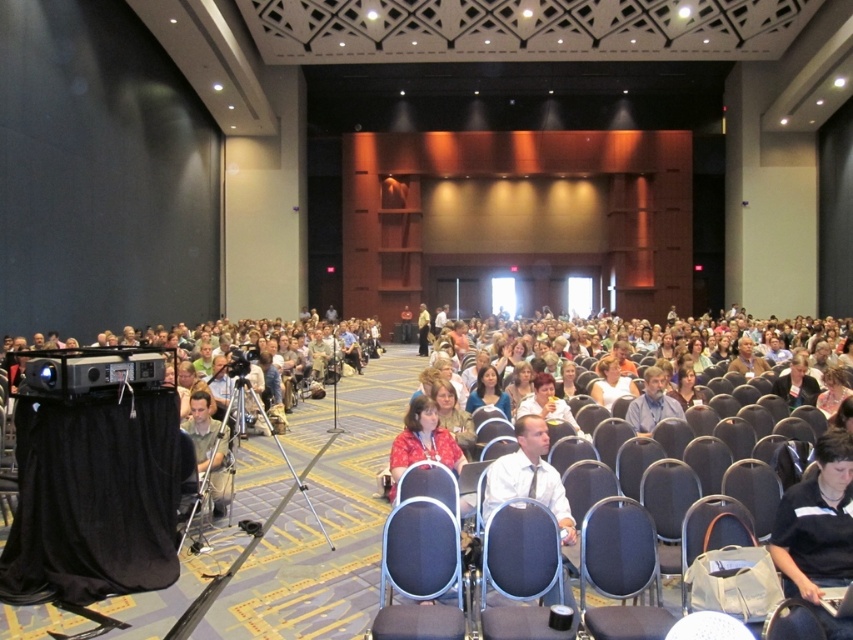
Who is shorter, black fabric chair at center or blue shirt at center?

blue shirt at center

Does black fabric chair at center lie behind blue shirt at center?

No.

Where is `black fabric chair at center`? The width and height of the screenshot is (853, 640). black fabric chair at center is located at coordinates (421, 573).

Describe the element at coordinates (712, 531) in the screenshot. I see `gray fabric chair at lower right` at that location.

Which is more to the right, gray fabric chair at lower right or matte black chair at lower right?

From the viewer's perspective, matte black chair at lower right appears more on the right side.

Which is in front, point (735, 504) or point (759, 493)?

Point (735, 504) is in front.

This screenshot has height=640, width=853. Find the location of `gray fabric chair at lower right`. gray fabric chair at lower right is located at coordinates (712, 531).

Is point (694, 538) behind point (222, 452)?

No, it is not.

Between gray fabric chair at lower right and light brown fabric shirt at lower left, which one appears on the left side from the viewer's perspective?

Positioned to the left is light brown fabric shirt at lower left.

Does point (741, 541) lie behind point (207, 419)?

No, it is not.

Image resolution: width=853 pixels, height=640 pixels. What are the coordinates of `gray fabric chair at lower right` in the screenshot? It's located at (712, 531).